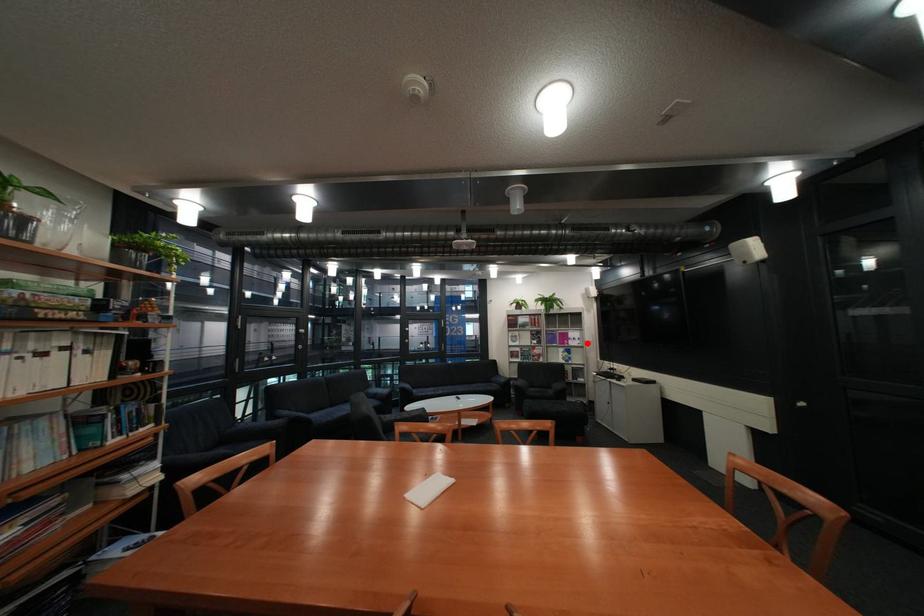
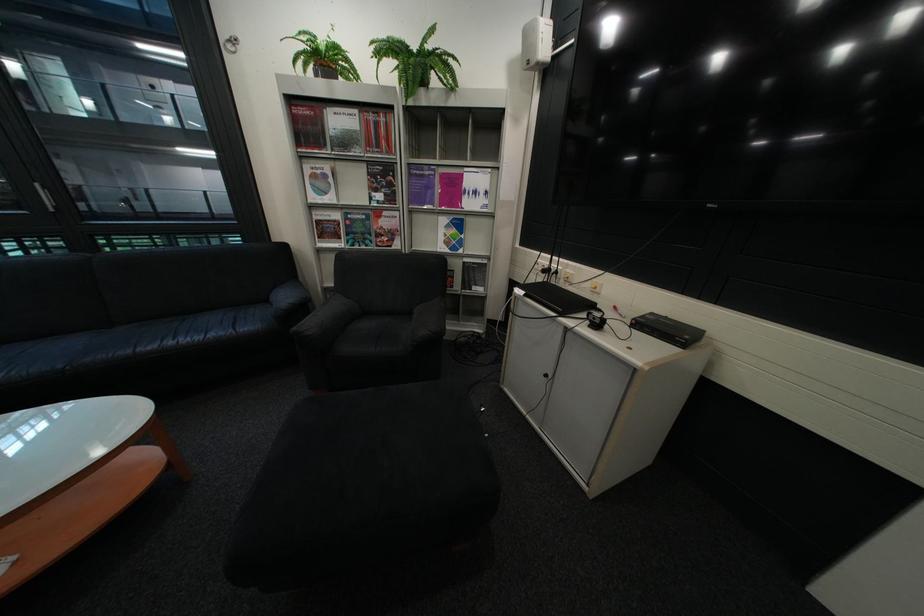
Question: I am providing you with two images of the same scene from different viewpoints. A red point is marked on the first image. At the location where the point appears in image 1, is it still visible in image 2?

Choices:
 (A) Yes
 (B) No

Answer: (A)